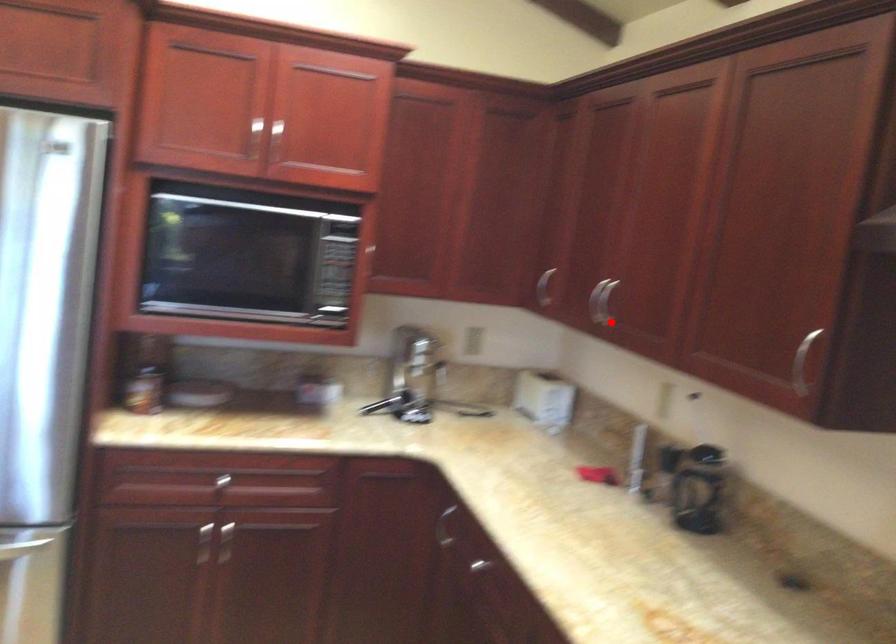
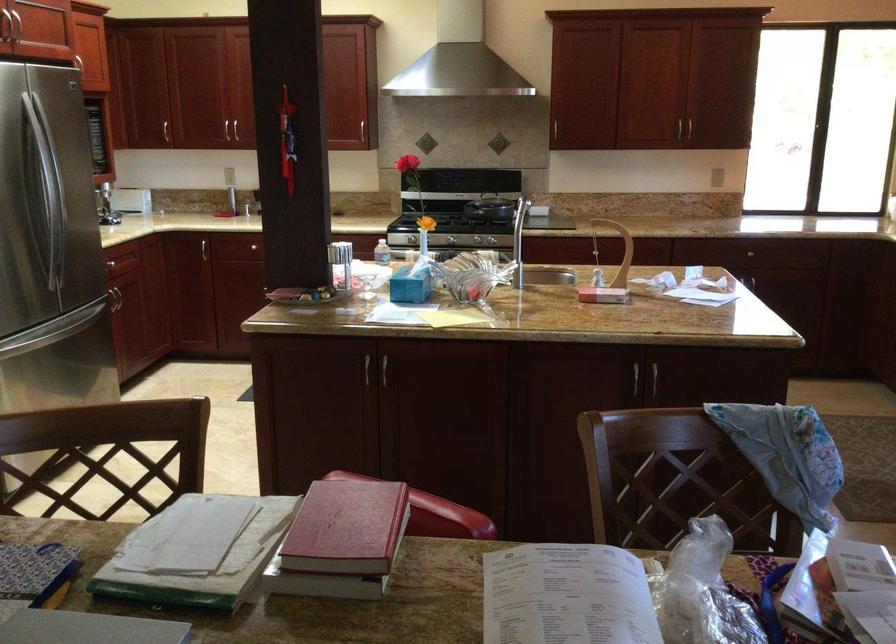
Question: I am providing you with two images of the same scene from different viewpoints. A red point is marked on the first image. Is the red point's position out of view in image 2?

Choices:
 (A) Yes
 (B) No

Answer: (B)